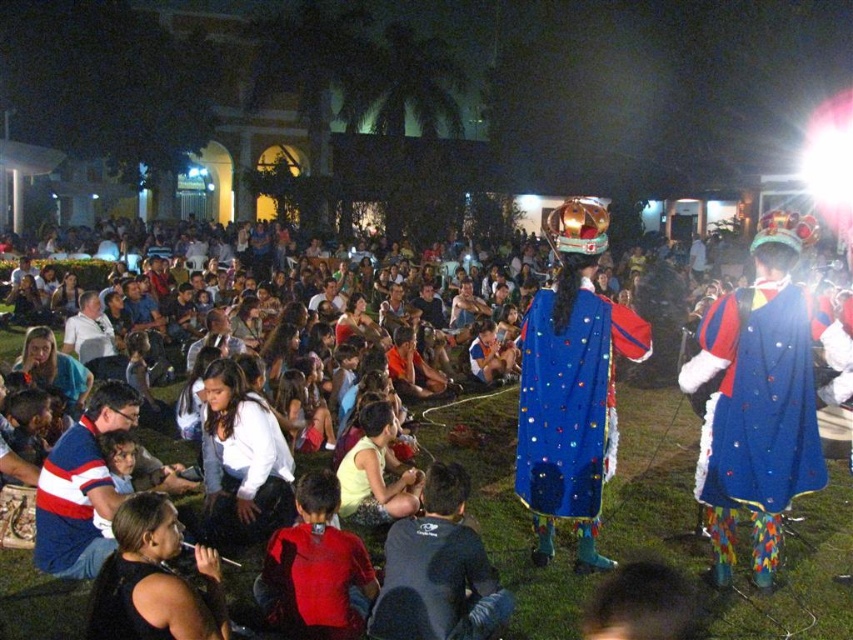
You are an event photographer at the scene. You need to capture a photo that includes both the blue sequined cape at center and the dark gray fabric shirt at lower center. Based on their positions, which object should you focus on first to ensure both are in the frame?

The blue sequined cape at center is positioned on the right side of dark gray fabric shirt at lower center. To capture both in the frame, focus on the dark gray fabric shirt at lower center first as it is on the left, allowing the cape to naturally fall into the right side of the frame.

You are an event organizer checking the seating arrangement for the performers. You see the black fabric shirt at lower left and the striped cotton shirt at lower left. Which performer is wearing a larger sized shirt?

The black fabric shirt at lower left is larger in size than the striped cotton shirt at lower left, so the performer wearing the black fabric shirt at lower left has the larger sized shirt.